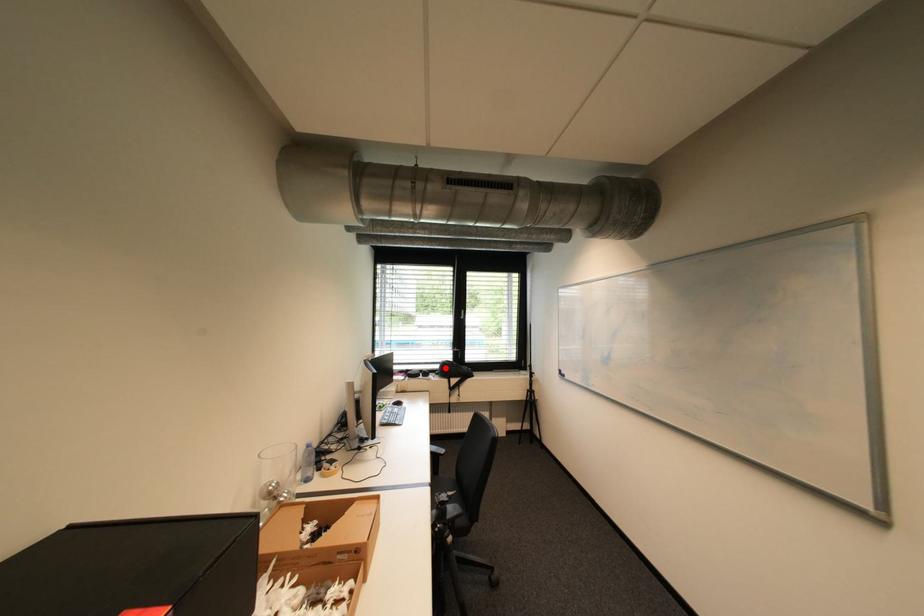
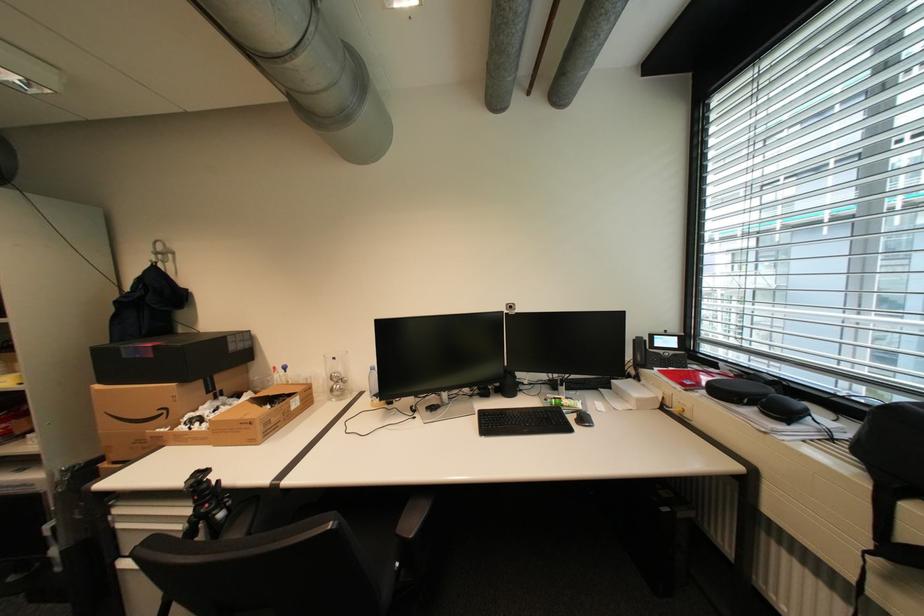
Question: I am providing you with two images of the same scene from different viewpoints. A red point is marked on the first image. Can you still see the location of the red point in image 2?

Choices:
 (A) Yes
 (B) No

Answer: (B)